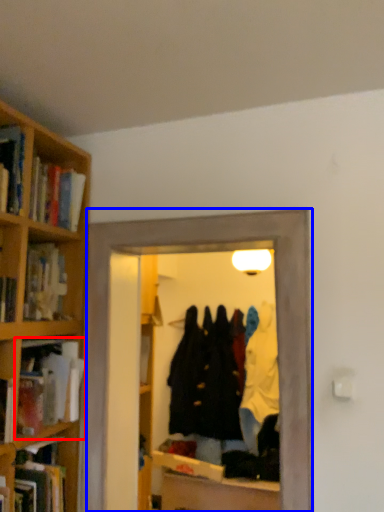
Question: Which object is further to the camera taking this photo, book (highlighted by a red box) or glass door (highlighted by a blue box)?

Choices:
 (A) book
 (B) glass door

Answer: (A)